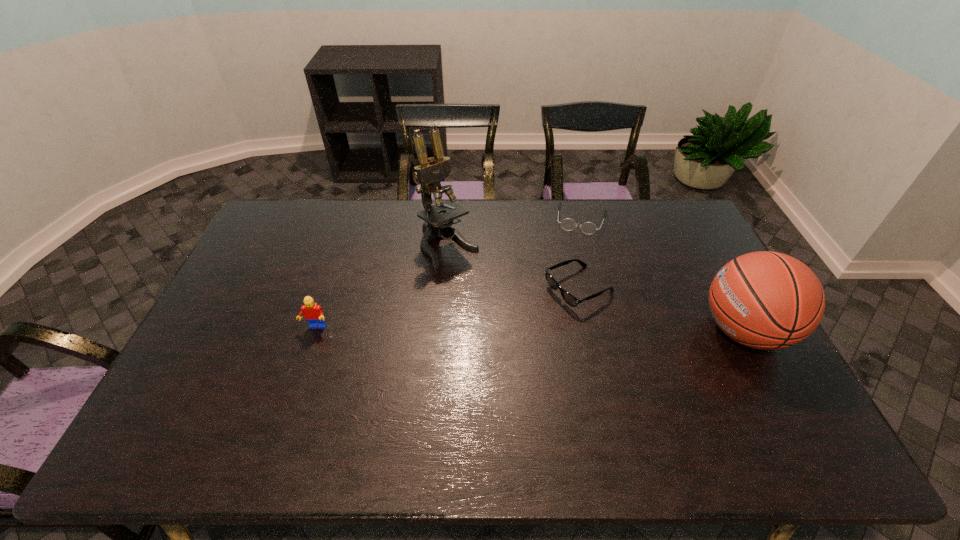
Where is `the third tallest object`? This screenshot has height=540, width=960. the third tallest object is located at coordinates (313, 313).

You are a GUI agent. You are given a task and a screenshot of the screen. Output one action in this format:
    pyautogui.click(x=<x>, y=<y>)
    Task: Click on the leftmost object
    
    Given the screenshot: What is the action you would take?
    pyautogui.click(x=313, y=313)

Find the location of a particular element. This screenshot has width=960, height=540. basketball is located at coordinates (766, 300).

Identify the location of the rightmost object. The height and width of the screenshot is (540, 960). (766, 300).

Identify the location of the tallest object. (428, 174).

Locate an element on the screen. The image size is (960, 540). the second object from left to right is located at coordinates (428, 174).

You are a GUI agent. You are given a task and a screenshot of the screen. Output one action in this format:
    pyautogui.click(x=<x>, y=<y>)
    Task: Click on the nearer spectacles
    
    Given the screenshot: What is the action you would take?
    pyautogui.click(x=568, y=298)

At what (x,y) coordinates should I click in order to perform the action: click on the shorter spectacles. Please return your answer as a coordinate pair (x, y). Looking at the image, I should click on (567, 224).

Where is `the farther spectacles`? This screenshot has width=960, height=540. the farther spectacles is located at coordinates (567, 224).

Find the location of a particular element. blank area located on the front-facing side of the third tallest object is located at coordinates (293, 398).